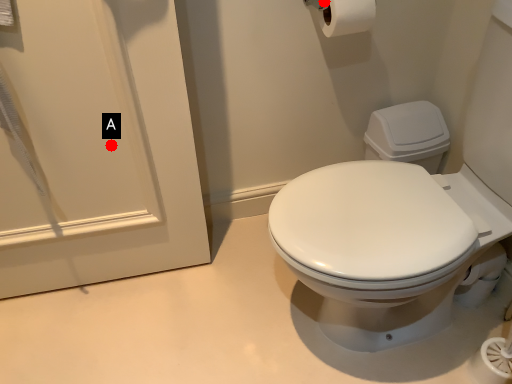
Question: Two points are circled on the image, labeled by A and B beside each circle. Which of the following is the closest to the observer?

Choices:
 (A) A is closer
 (B) B is closer

Answer: (A)